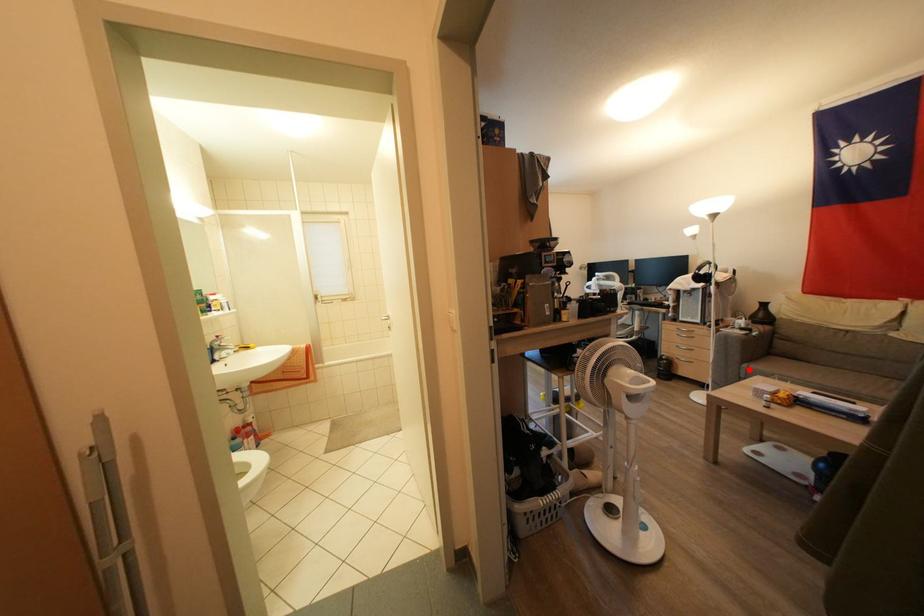
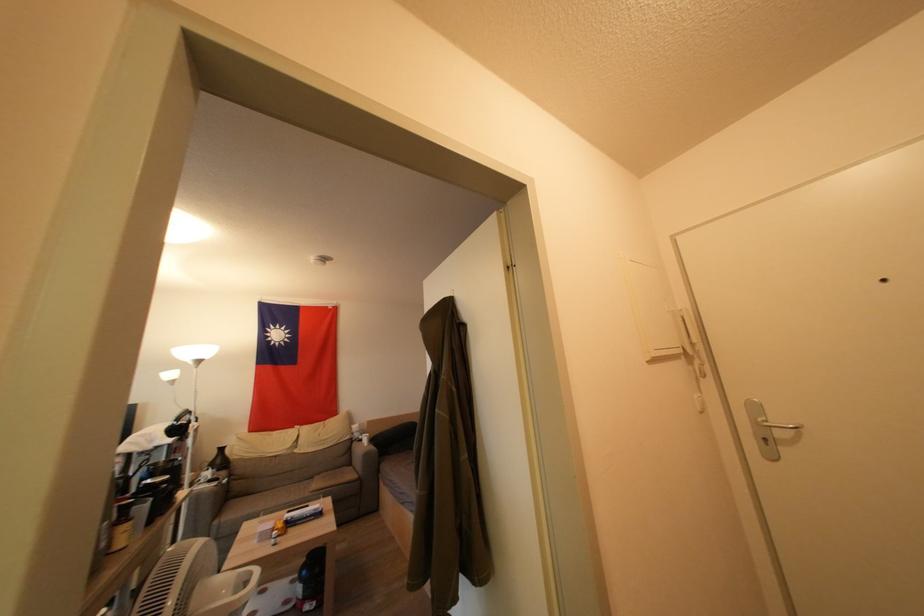
Where in the second image is the point corresponding to the highlighted location from the first image?

(221, 525)